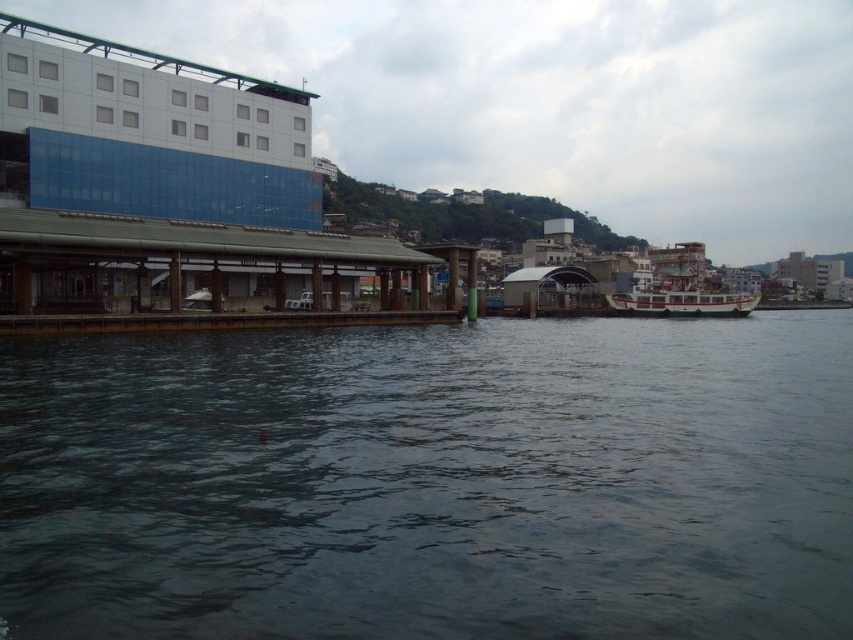
Question: Estimate the real-world distances between objects in this image. Which object is farther from the dark water at lower center?

Choices:
 (A) white matte boat at center
 (B) brown wooden dock at lower left

Answer: (A)

Question: Does dark water at lower center appear under brown wooden dock at lower left?

Choices:
 (A) yes
 (B) no

Answer: (A)

Question: Which object appears farthest from the camera in this image?

Choices:
 (A) white matte boat at center
 (B) brown wooden dock at lower left

Answer: (A)

Question: Is dark water at lower center wider than white matte boat at center?

Choices:
 (A) no
 (B) yes

Answer: (B)

Question: Is the position of dark water at lower center more distant than that of white matte boat at center?

Choices:
 (A) yes
 (B) no

Answer: (B)

Question: Estimate the real-world distances between objects in this image. Which object is closer to the brown wooden dock at lower left?

Choices:
 (A) dark water at lower center
 (B) white matte boat at center

Answer: (A)